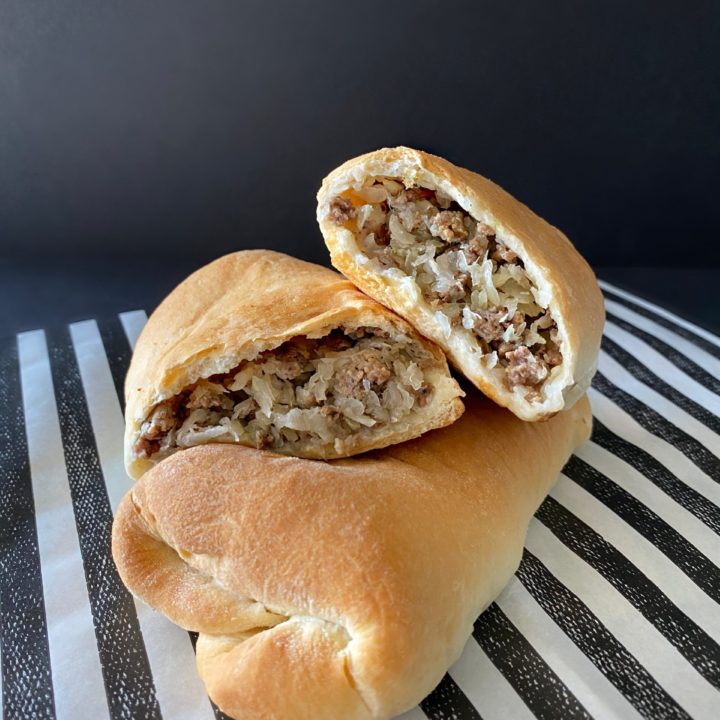
Find the location of a particular element. cloth is located at coordinates point(621,570).